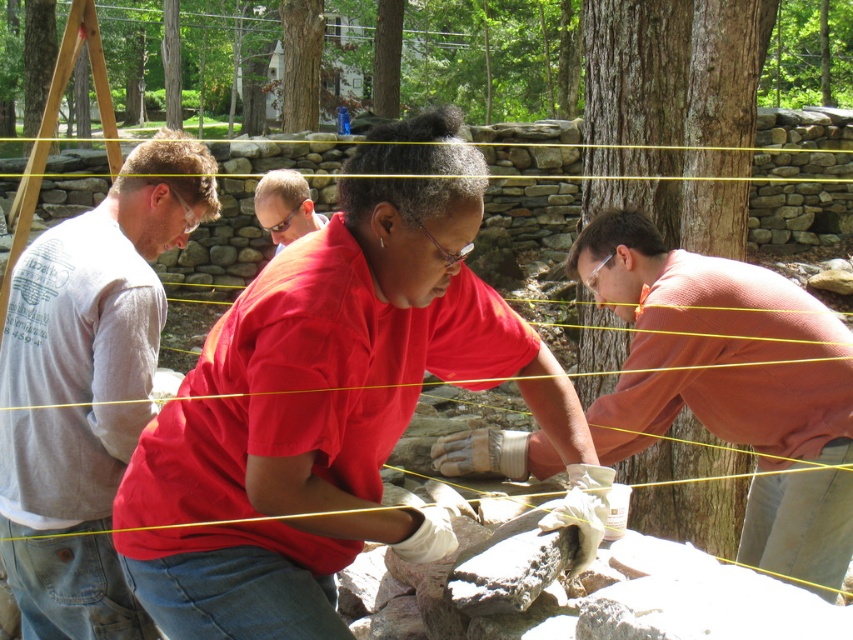
Question: Considering the real-world distances, which object is farthest from the matte gray shirt at center?

Choices:
 (A) matte black glasses at center
 (B) matte orange shirt at center

Answer: (A)

Question: Is the position of gray cotton shirt at left more distant than that of matte orange shirt at center?

Choices:
 (A) no
 (B) yes

Answer: (A)

Question: Which point is closer to the camera taking this photo?

Choices:
 (A) (840, 385)
 (B) (250, 323)

Answer: (B)

Question: Is gray cotton shirt at left above matte orange shirt at center?

Choices:
 (A) yes
 (B) no

Answer: (A)

Question: Can you confirm if matte gray shirt at center is smaller than gray cotton shirt at left?

Choices:
 (A) no
 (B) yes

Answer: (B)

Question: Among these objects, which one is nearest to the camera?

Choices:
 (A) gray cotton shirt at left
 (B) matte black glasses at center
 (C) matte orange shirt at center
 (D) matte gray shirt at center

Answer: (D)